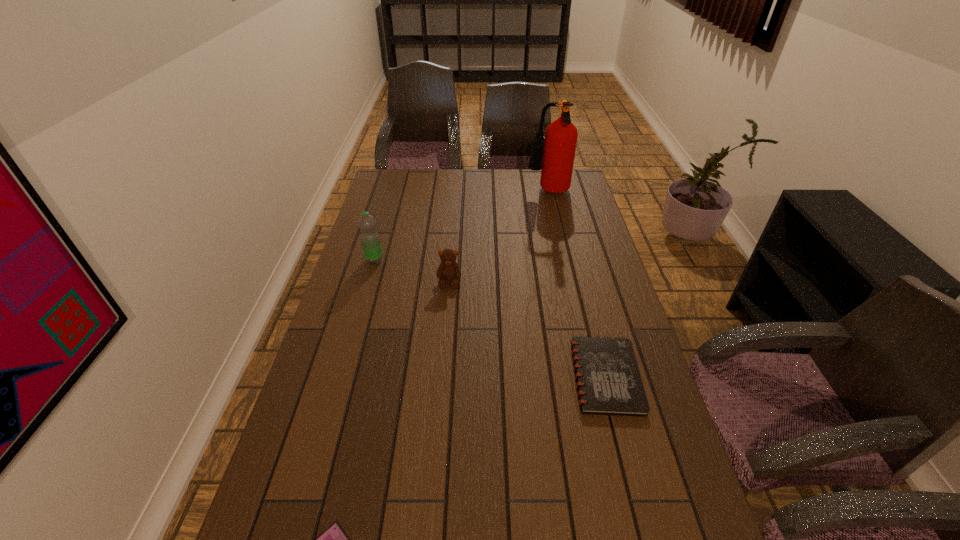
Locate an element on the screen. the farthest object is located at coordinates (560, 140).

This screenshot has height=540, width=960. I want to click on the tallest object, so click(x=560, y=140).

Find the location of `the fourth shortest object`. the fourth shortest object is located at coordinates [x=370, y=240].

Image resolution: width=960 pixels, height=540 pixels. I want to click on water bottle, so click(370, 240).

I want to click on the third object from right to left, so click(x=448, y=269).

Where is `the third nearest object`? This screenshot has width=960, height=540. the third nearest object is located at coordinates (448, 269).

You are a GUI agent. You are given a task and a screenshot of the screen. Output one action in this format:
    pyautogui.click(x=<x>, y=<y>)
    Task: Click on the fourth tallest object
    The image size is (960, 540).
    Given the screenshot: What is the action you would take?
    pos(608,379)

Identify the location of notebook. (608, 379).

Locate an element on the screen. Image resolution: width=960 pixels, height=540 pixels. vacant space located at the nozzle of the farthest object is located at coordinates (x=438, y=193).

Where is `vacant space located at the nozzle of the farthest object`? vacant space located at the nozzle of the farthest object is located at coordinates (464, 193).